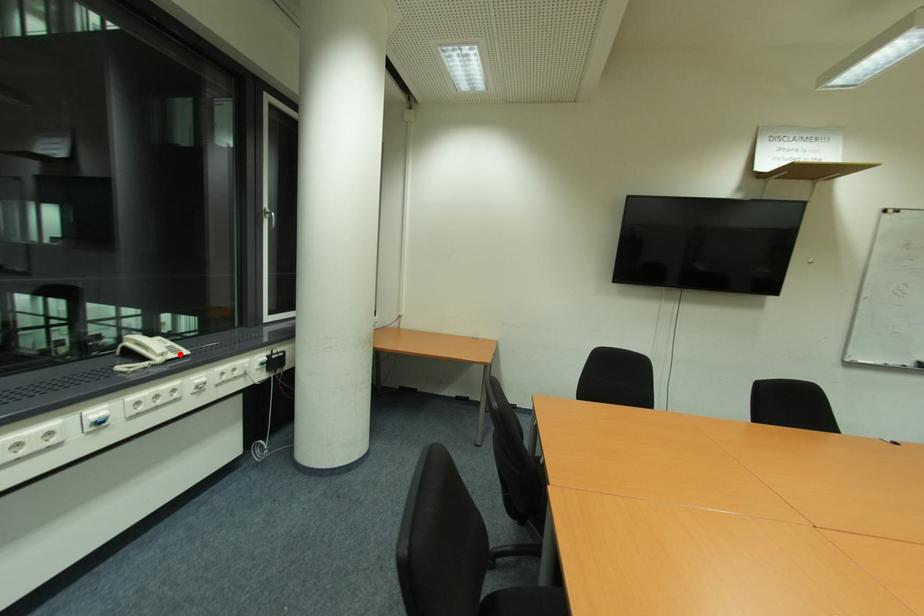
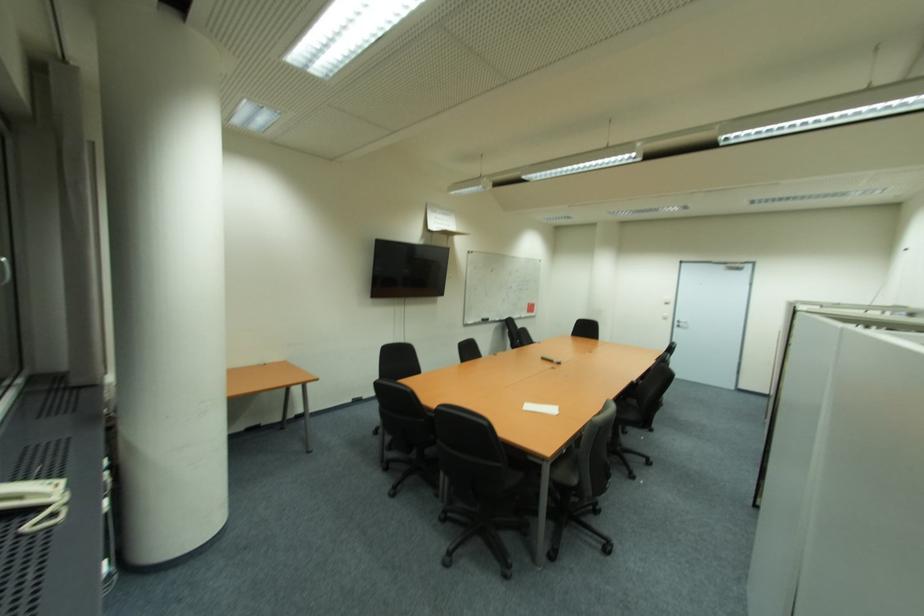
The point at the highlighted location is marked in the first image. Where is the corresponding point in the second image?

(57, 488)